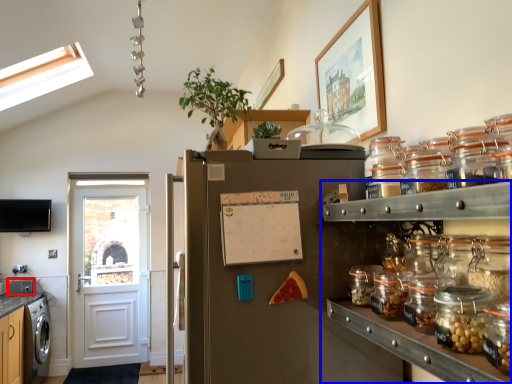
Question: Which object appears closest to the camera in this image, appliance (highlighted by a red box) or shelf (highlighted by a blue box)?

Choices:
 (A) appliance
 (B) shelf

Answer: (B)